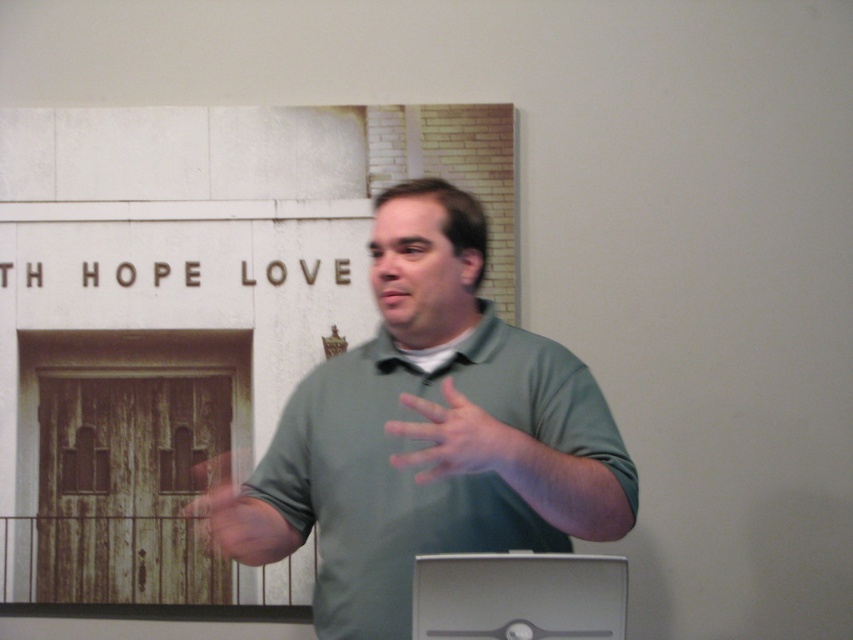
Between green matte shirt at center and matte green shirt at center, which one has more height?

green matte shirt at center is taller.

Who is positioned more to the left, green matte shirt at center or matte green shirt at center?

From the viewer's perspective, green matte shirt at center appears more on the left side.

The width and height of the screenshot is (853, 640). What are the coordinates of `green matte shirt at center` in the screenshot? It's located at (434, 432).

Can you confirm if green matte shirt at center is shorter than wooden door at center?

Incorrect, green matte shirt at center's height does not fall short of wooden door at center's.

Which is more to the right, green matte shirt at center or wooden door at center?

Positioned to the right is green matte shirt at center.

You are a GUI agent. You are given a task and a screenshot of the screen. Output one action in this format:
    pyautogui.click(x=<x>, y=<y>)
    Task: Click on the green matte shirt at center
    The width and height of the screenshot is (853, 640).
    Given the screenshot: What is the action you would take?
    pyautogui.click(x=434, y=432)

Which is below, satin silver computer at lower center or wooden door at center?

satin silver computer at lower center is below.

Does satin silver computer at lower center appear on the left side of wooden door at center?

In fact, satin silver computer at lower center is to the right of wooden door at center.

Who is more forward, (524, 600) or (253, 502)?

Point (524, 600) is in front.

Image resolution: width=853 pixels, height=640 pixels. I want to click on satin silver computer at lower center, so click(519, 596).